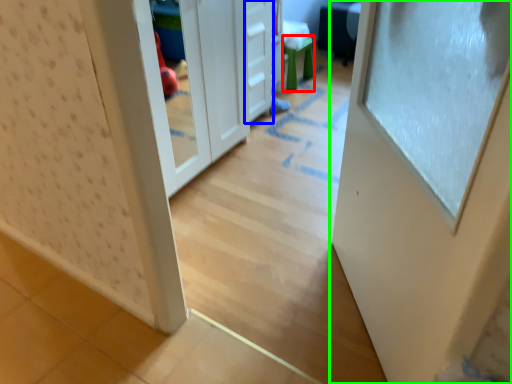
Question: Which object is positioned farthest from stool (highlighted by a red box)? Select from drawer (highlighted by a blue box) and door (highlighted by a green box).

Choices:
 (A) drawer
 (B) door

Answer: (B)